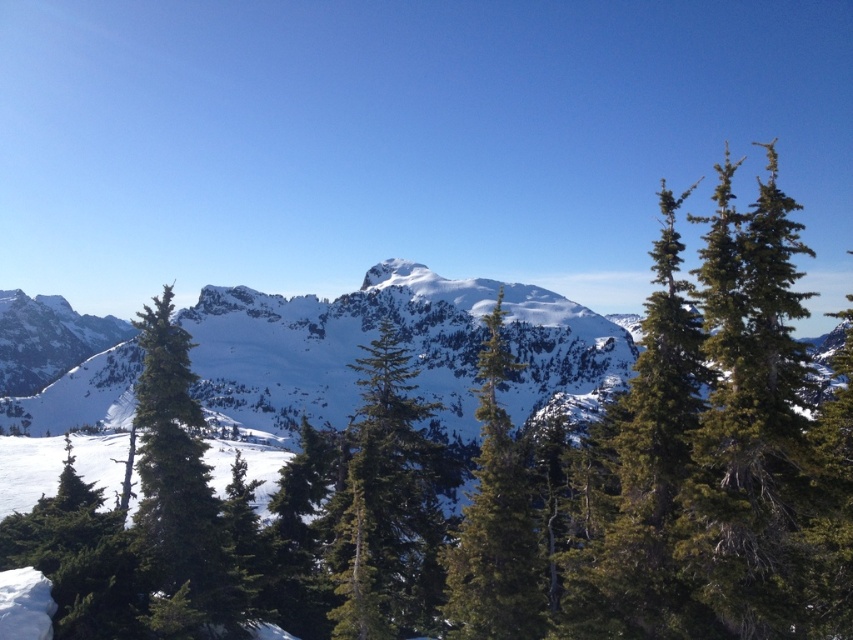
Between point (434, 522) and point (505, 467), which one is positioned in front?

Point (505, 467)

Looking at this image, is green textured tree at center above green textured pine tree at center?

Incorrect, green textured tree at center is not positioned above green textured pine tree at center.

Is point (375, 381) positioned behind point (447, 600)?

Yes, point (375, 381) is farther from viewer.

Image resolution: width=853 pixels, height=640 pixels. In order to click on green textured tree at center in this screenshot , I will do `click(387, 504)`.